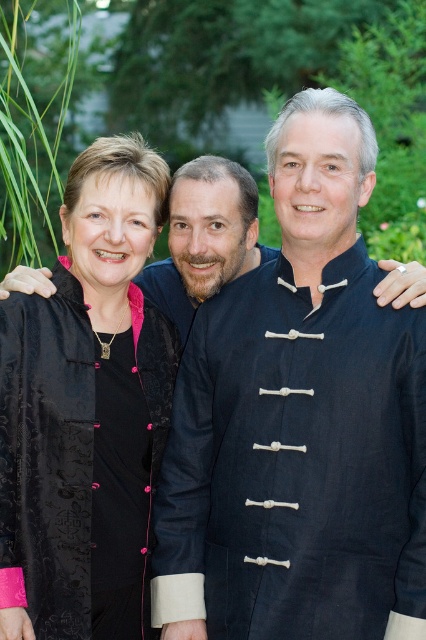
From the picture: Can you confirm if black satin blouse at left is positioned to the left of matte black shirt at center?

Indeed, black satin blouse at left is positioned on the left side of matte black shirt at center.

Is black satin blouse at left thinner than matte black shirt at center?

Yes, black satin blouse at left is thinner than matte black shirt at center.

Which is behind, point (124, 362) or point (204, 253)?

The point (204, 253) is more distant.

Identify the location of black satin blouse at left. The height and width of the screenshot is (640, 426). (88, 403).

Who is more distant from viewer, [354,547] or [58,314]?

Positioned behind is point [58,314].

This screenshot has height=640, width=426. What do you see at coordinates (296, 461) in the screenshot?
I see `dark blue fabric robe at center` at bounding box center [296, 461].

Locate an element on the screen. The image size is (426, 640). dark blue fabric robe at center is located at coordinates (x=296, y=461).

Which of these two, dark blue fabric robe at center or matte black shirt at center, stands shorter?

Standing shorter between the two is matte black shirt at center.

Is point (186, 432) positioned behind point (175, 317)?

No, it is not.

The width and height of the screenshot is (426, 640). What are the coordinates of `dark blue fabric robe at center` in the screenshot? It's located at (296, 461).

Find the location of a particular element. dark blue fabric robe at center is located at coordinates (296, 461).